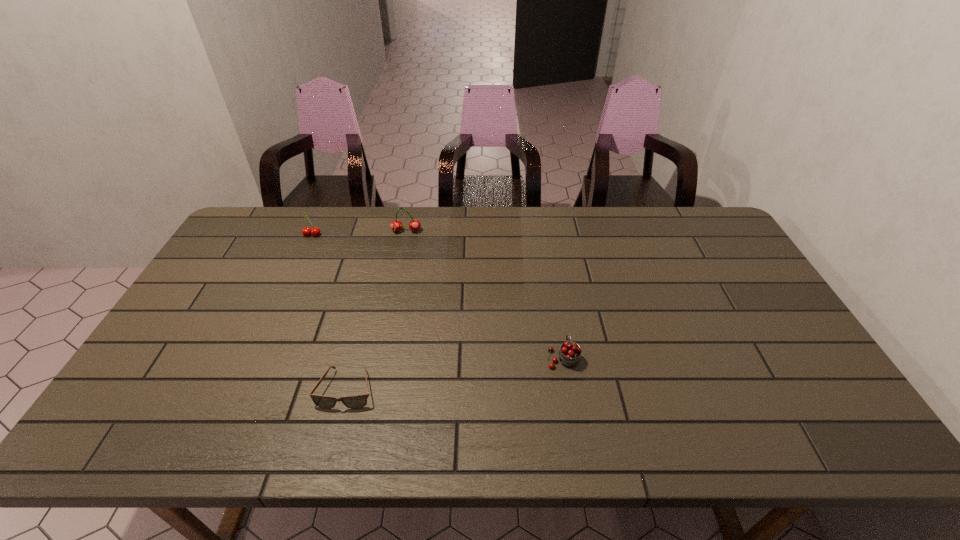
Find the location of `vacant space that is in between the shortest object and the rightmost cherry`. vacant space that is in between the shortest object and the rightmost cherry is located at coordinates click(x=455, y=373).

Where is `vacant space in between the leftmost cherry and the second cherry from left to right`? Image resolution: width=960 pixels, height=540 pixels. vacant space in between the leftmost cherry and the second cherry from left to right is located at coordinates (359, 233).

You are a GUI agent. You are given a task and a screenshot of the screen. Output one action in this format:
    pyautogui.click(x=<x>, y=<y>)
    Task: Click on the free spot between the shortest object and the tallest object
    Image resolution: width=960 pixels, height=540 pixels.
    Given the screenshot: What is the action you would take?
    pyautogui.click(x=376, y=310)

The width and height of the screenshot is (960, 540). Find the location of `vacant region between the sunglasses and the tallest object`. vacant region between the sunglasses and the tallest object is located at coordinates (376, 310).

Locate an element on the screen. the closest object to the second cherry from left to right is located at coordinates (315, 231).

In order to click on object that is the second closest to the rightmost cherry in this screenshot , I will do `click(396, 225)`.

This screenshot has height=540, width=960. Identify the location of cherry that is the nearest to the second cherry from right to left. (315, 231).

This screenshot has height=540, width=960. In order to click on cherry that is the nearest to the tallest cherry in this screenshot , I will do `click(315, 231)`.